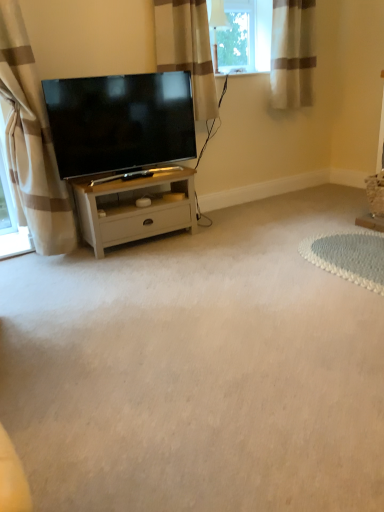
Question: Does white wood cabinet at center have a lesser height compared to beige striped curtain at left, the third curtain when ordered from right to left?

Choices:
 (A) yes
 (B) no

Answer: (A)

Question: From the image's perspective, is white wood cabinet at center located beneath beige striped curtain at left, the third curtain when ordered from right to left?

Choices:
 (A) no
 (B) yes

Answer: (B)

Question: Is white wood cabinet at center taller than beige striped curtain at left, the third curtain when ordered from right to left?

Choices:
 (A) no
 (B) yes

Answer: (A)

Question: Does white wood cabinet at center turn towards beige striped curtain at left, the third curtain when ordered from right to left?

Choices:
 (A) yes
 (B) no

Answer: (B)

Question: Is the position of white wood cabinet at center less distant than that of beige striped curtain at left, the 1th curtain in the left-to-right sequence?

Choices:
 (A) yes
 (B) no

Answer: (B)

Question: Is white wood cabinet at center bigger than beige striped curtain at left, the third curtain when ordered from right to left?

Choices:
 (A) no
 (B) yes

Answer: (A)

Question: Are beige striped curtain at left, the 1th curtain in the left-to-right sequence, and white wood cabinet at center beside each other?

Choices:
 (A) no
 (B) yes

Answer: (A)

Question: Is white wood cabinet at center completely or partially inside beige striped curtain at left, the 1th curtain in the left-to-right sequence?

Choices:
 (A) no
 (B) yes

Answer: (A)

Question: From the image's perspective, is beige striped curtain at left, the third curtain when ordered from right to left, located beneath white wood cabinet at center?

Choices:
 (A) yes
 (B) no

Answer: (B)

Question: Is beige striped curtain at left, the 1th curtain in the left-to-right sequence, not within white wood cabinet at center?

Choices:
 (A) yes
 (B) no

Answer: (A)

Question: Does beige striped curtain at left, the 1th curtain in the left-to-right sequence, have a smaller size compared to white wood cabinet at center?

Choices:
 (A) yes
 (B) no

Answer: (B)

Question: From the image's perspective, does beige striped curtain at left, the third curtain when ordered from right to left, appear higher than white wood cabinet at center?

Choices:
 (A) no
 (B) yes

Answer: (B)

Question: Considering the relative positions of beige striped curtain at upper right, which is the 1th curtain in right-to-left order, and beige striped curtain at left, the third curtain when ordered from right to left, in the image provided, is beige striped curtain at upper right, which is the 1th curtain in right-to-left order, to the right of beige striped curtain at left, the third curtain when ordered from right to left, from the viewer's perspective?

Choices:
 (A) no
 (B) yes

Answer: (B)